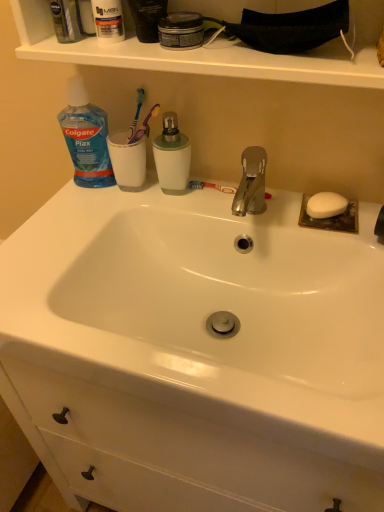
At what (x,y) coordinates should I click in order to perform the action: click on free space to the right of blue plastic toothbrush at upper center. Please return your answer as a coordinate pair (x, y). Looking at the image, I should click on (222, 190).